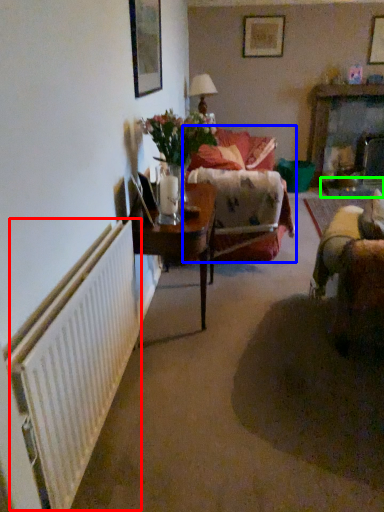
Question: Which is nearer to the radiator (highlighted by a red box)? studio couch (highlighted by a blue box) or glass table (highlighted by a green box).

Choices:
 (A) studio couch
 (B) glass table

Answer: (A)